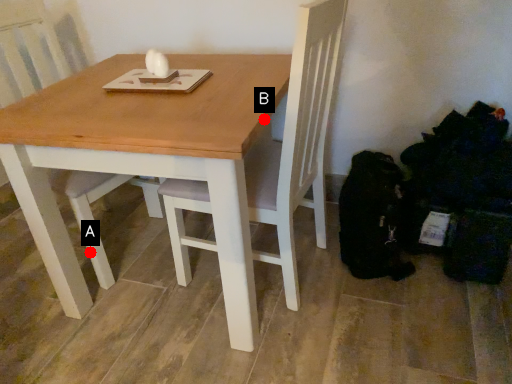
Question: Two points are circled on the image, labeled by A and B beside each circle. Among these points, which one is nearest to the camera?

Choices:
 (A) A is closer
 (B) B is closer

Answer: (B)